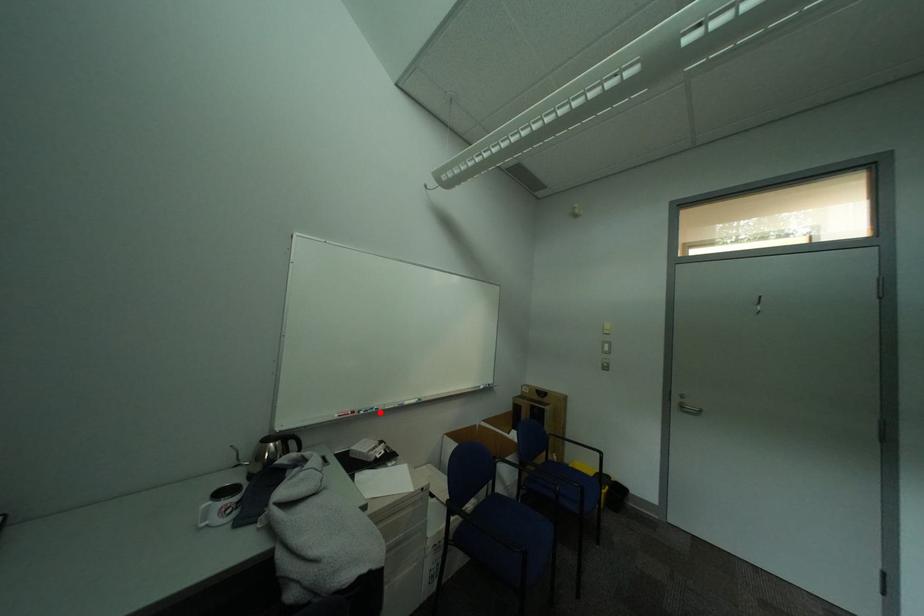
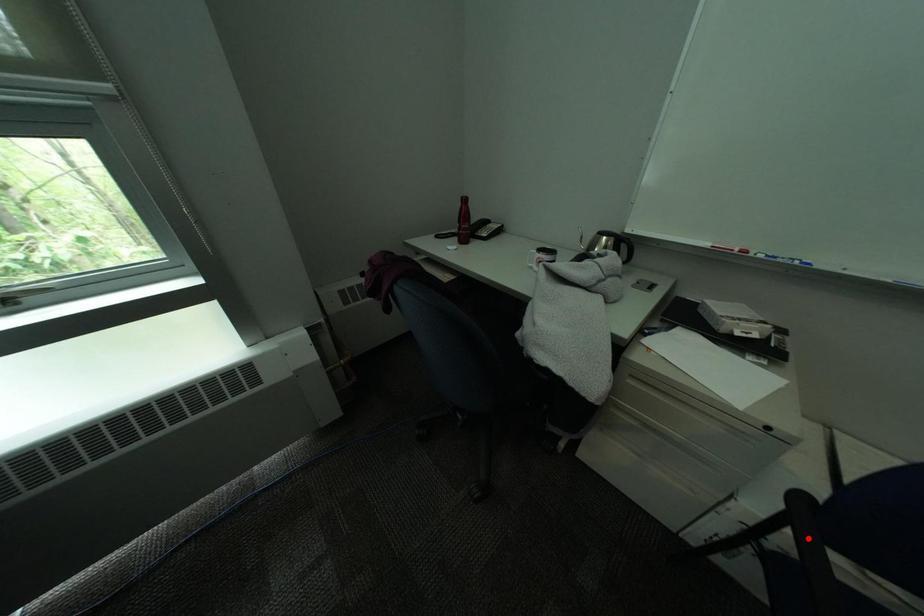
I am providing you with two images of the same scene from different viewpoints. A red point is marked on the first image and another point is marked on the second image. Is the red point in image1 aligned with the point shown in image2?

No